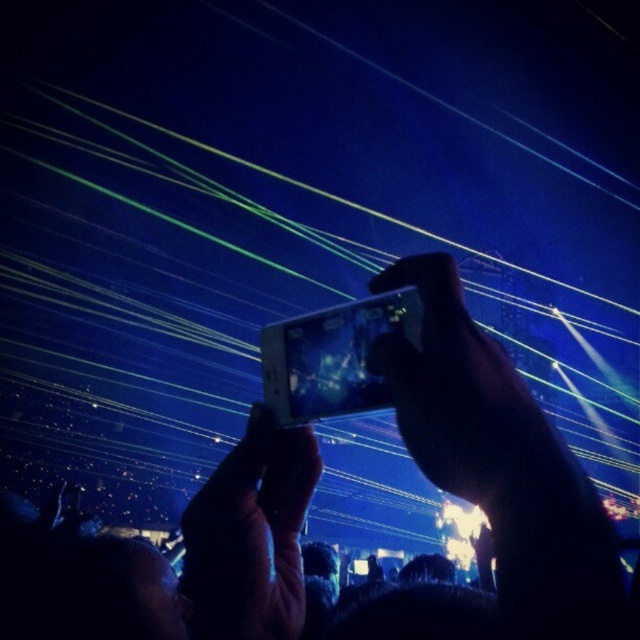
Can you confirm if matte black phone at center is thinner than black matte phone at center?

Yes.

Between matte black phone at center and black matte phone at center, which one is positioned lower?

black matte phone at center is lower down.

Who is more forward, (467, 394) or (237, 637)?

Point (467, 394) is more forward.

Locate an element on the screen. matte black phone at center is located at coordinates (464, 396).